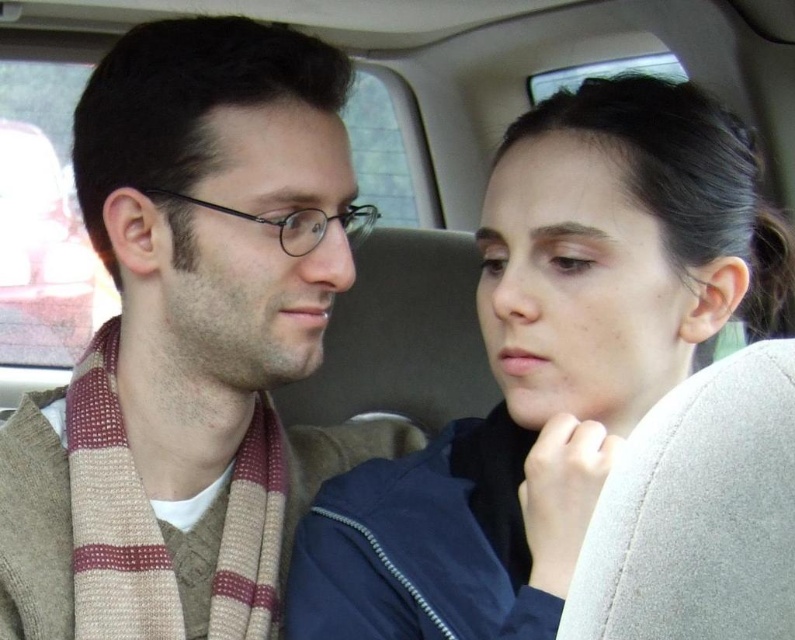
Who is lower down, knitted scarf at left or gray fabric at upper right?

gray fabric at upper right

Between knitted scarf at left and gray fabric at upper right, which one appears on the left side from the viewer's perspective?

knitted scarf at left

Is point (192, 538) more distant than point (654, 477)?

Yes.

This screenshot has height=640, width=795. I want to click on knitted scarf at left, so click(189, 342).

How much distance is there between knitted scarf at left and smooth navy blue jacket at center?

The distance of knitted scarf at left from smooth navy blue jacket at center is 10.54 inches.

Does knitted scarf at left have a greater height compared to smooth navy blue jacket at center?

Yes.

Describe the element at coordinates (189, 342) in the screenshot. The width and height of the screenshot is (795, 640). I see `knitted scarf at left` at that location.

The image size is (795, 640). I want to click on knitted scarf at left, so click(189, 342).

Is smooth navy blue jacket at center thinner than gray fabric at upper right?

Incorrect, smooth navy blue jacket at center's width is not less than gray fabric at upper right's.

Between smooth navy blue jacket at center and gray fabric at upper right, which one appears on the left side from the viewer's perspective?

Positioned to the left is gray fabric at upper right.

Who is more forward, (739, 237) or (677, 513)?

Point (677, 513)

I want to click on smooth navy blue jacket at center, so click(x=553, y=364).